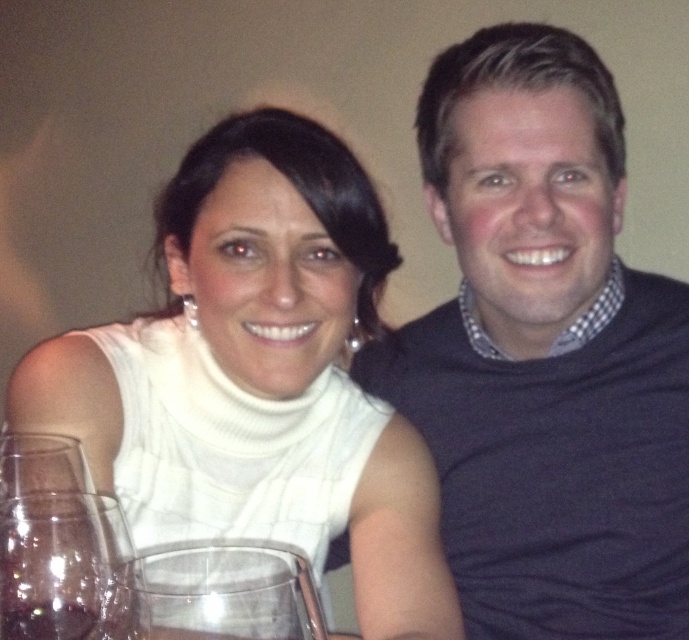
Question: Among these points, which one is farthest from the camera?

Choices:
 (A) (41, 612)
 (B) (384, 554)
 (C) (528, 593)

Answer: (C)

Question: Can you confirm if white turtleneck sweater at center is positioned above transparent glass wine glass at lower left?

Choices:
 (A) no
 (B) yes

Answer: (B)

Question: Which point is closer to the camera taking this photo?

Choices:
 (A) 50,618
 (B) 225,138
 (C) 658,355
 (D) 43,504

Answer: (A)

Question: Estimate the real-world distances between objects in this image. Which object is closer to the dark gray sweater at upper right?

Choices:
 (A) white turtleneck sweater at center
 (B) clear glass wine glass at lower left
 (C) transparent glass wine glass at lower left
 (D) transparent glass at lower left

Answer: (A)

Question: In this image, where is transparent glass wine glass at lower left located relative to transparent glass at lower left?

Choices:
 (A) below
 (B) above

Answer: (B)

Question: Is dark gray sweater at upper right wider than clear glass wine glass at lower left?

Choices:
 (A) no
 (B) yes

Answer: (B)